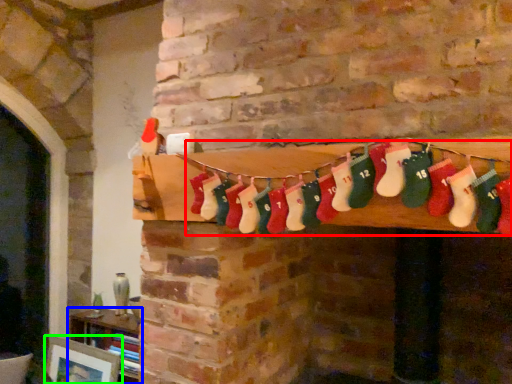
Question: Which object is positioned farthest from sock (highlighted by a red box)? Select from furniture (highlighted by a blue box) and picture frame (highlighted by a green box).

Choices:
 (A) furniture
 (B) picture frame

Answer: (B)